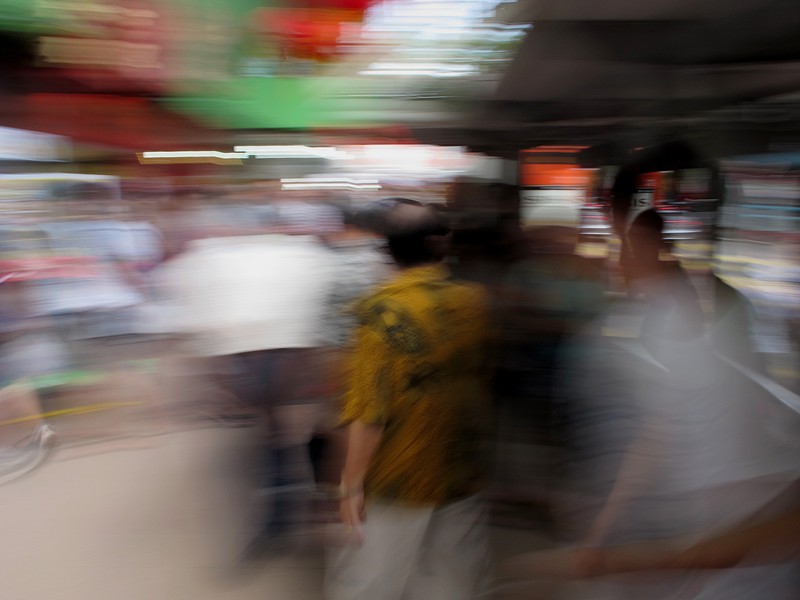
Where is `shelf case`? This screenshot has height=600, width=800. shelf case is located at coordinates (750, 196).